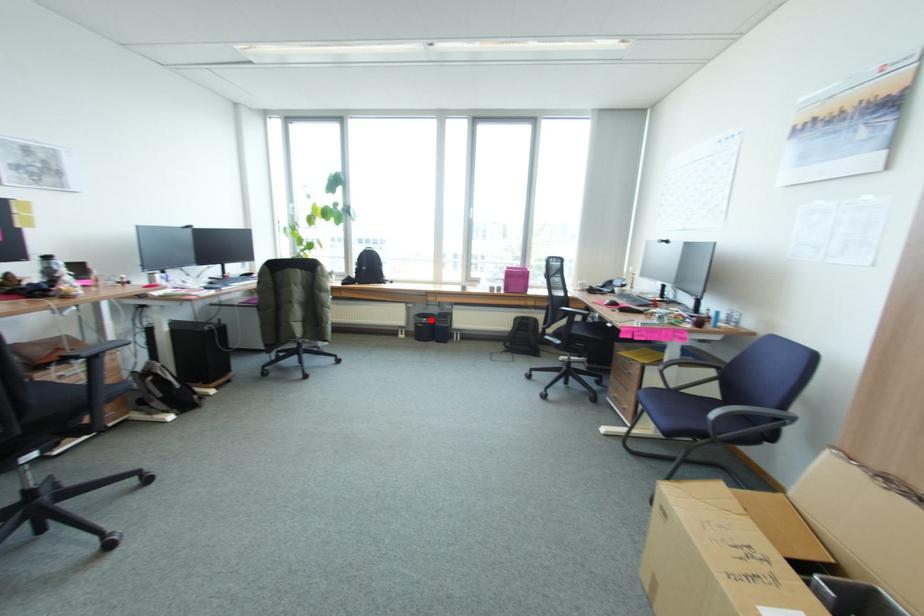
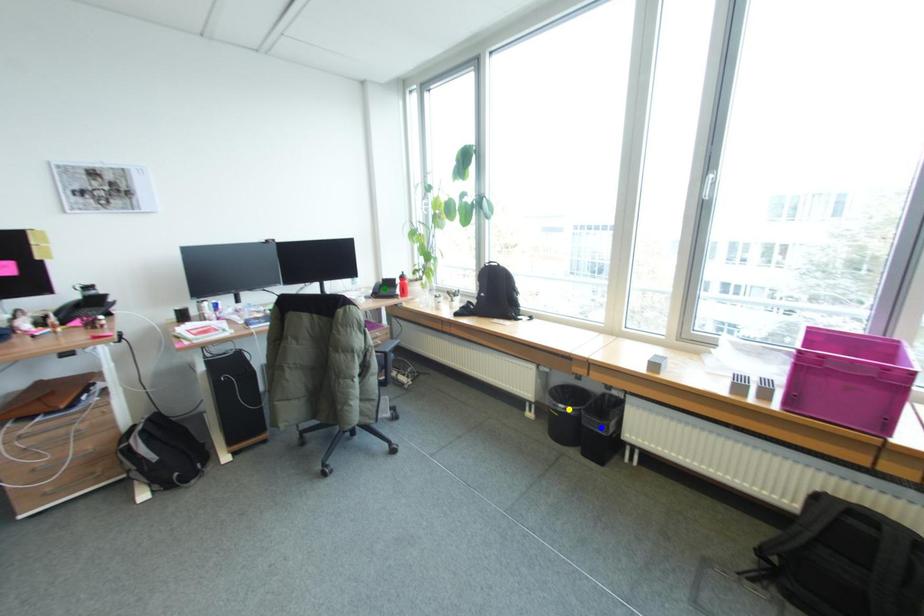
Question: I am providing you with two images of the same scene from different viewpoints. A red point is marked on the first image. You are given multiple points on the second image. Which mark in image 2 goes with the point in image 1?

Choices:
 (A) yellow point
 (B) blue point
 (C) green point

Answer: (A)